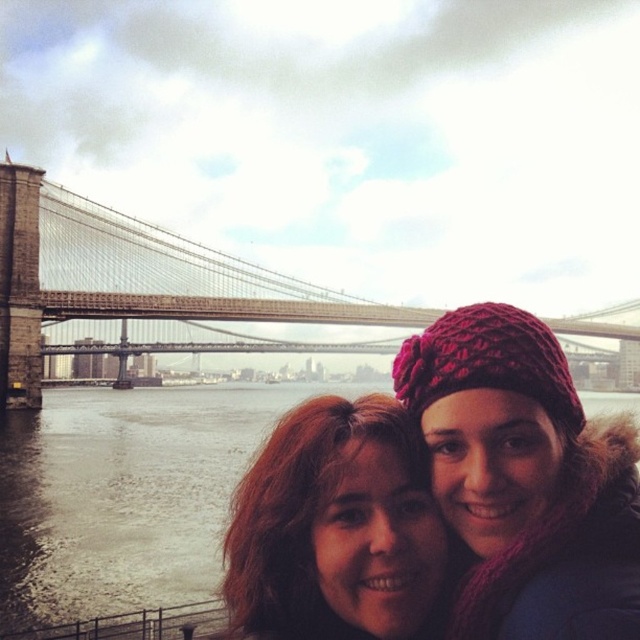
Looking at this image, can you confirm if knitted wool hat at center is positioned below stone bridge at center?

Correct, knitted wool hat at center is located below stone bridge at center.

Between knitted wool hat at center and stone bridge at center, which one is positioned higher?

stone bridge at center is above.

Between point (564, 566) and point (4, 195), which one is positioned behind?

The point (4, 195) is behind.

Identify the location of knitted wool hat at center. This screenshot has height=640, width=640. (524, 480).

Who is lower down, matte red knit hat at center or stone bridge at center?

matte red knit hat at center is below.

Based on the photo, can you confirm if matte red knit hat at center is positioned to the right of stone bridge at center?

In fact, matte red knit hat at center is to the left of stone bridge at center.

I want to click on matte red knit hat at center, so click(x=333, y=528).

Locate an element on the screen. matte red knit hat at center is located at coordinates (333, 528).

Between knitted wool hat at center and matte red knit hat at center, which one has less height?

matte red knit hat at center

Who is more forward, (589, 625) or (292, 486)?

Point (589, 625)

Identify the location of knitted wool hat at center. This screenshot has width=640, height=640. (x=524, y=480).